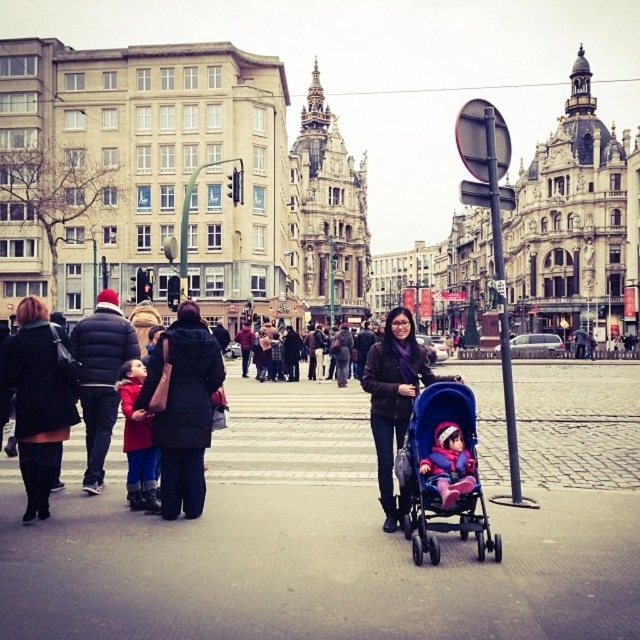
Question: Which point is closer to the camera taking this photo?

Choices:
 (A) (396, 458)
 (B) (401, 356)
 (C) (420, 467)

Answer: (C)

Question: Does blue plastic stroller at center have a larger size compared to matte black coat at center?

Choices:
 (A) no
 (B) yes

Answer: (A)

Question: Which of these objects is positioned closest to the matte pink fabric baby carriage at center?

Choices:
 (A) matte red coat at left
 (B) blue plastic stroller at center

Answer: (B)

Question: In this image, where is blue plastic stroller at center located relative to matte black coat at center?

Choices:
 (A) below
 (B) above

Answer: (A)

Question: Is matte black coat at center to the right of matte pink fabric baby carriage at center from the viewer's perspective?

Choices:
 (A) no
 (B) yes

Answer: (B)

Question: Which point is farther to the camera?

Choices:
 (A) (292, 336)
 (B) (445, 433)
 (C) (138, 444)

Answer: (A)